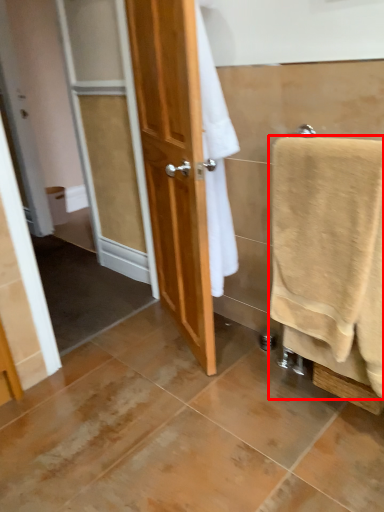
Question: Observing the image, what is the correct spatial positioning of towel (annotated by the red box) in reference to toilet paper?

Choices:
 (A) right
 (B) left

Answer: (A)